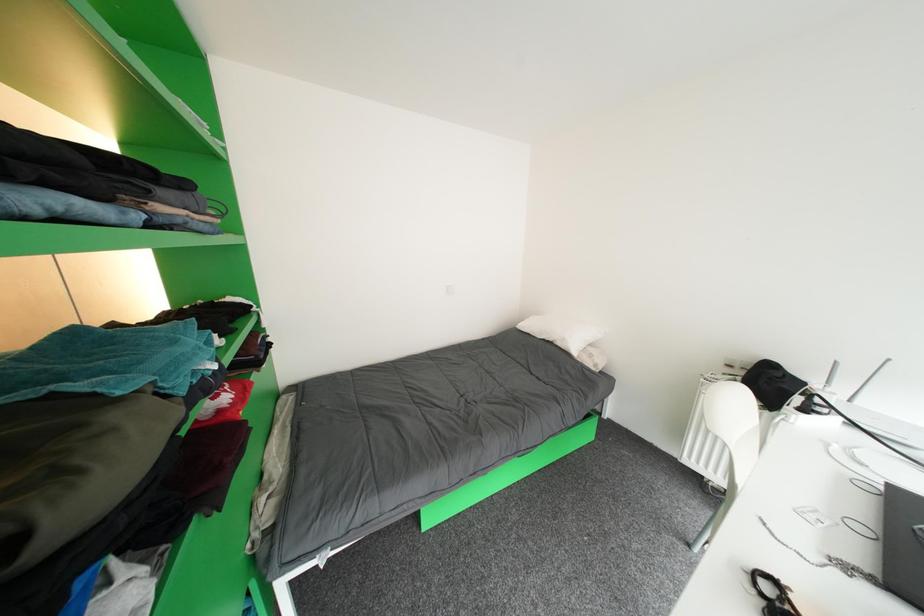
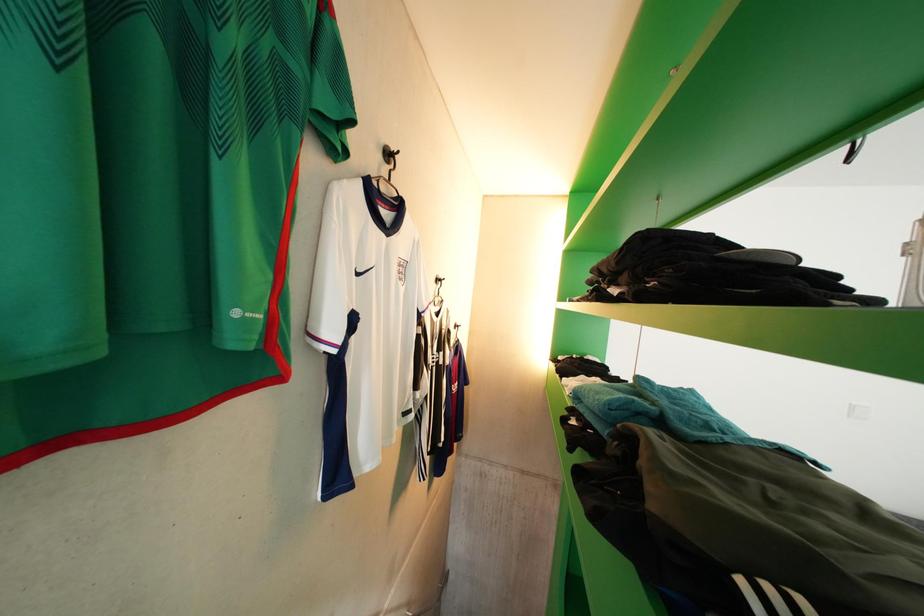
Question: The first image is from the beginning of the video and the second image is from the end. How did the camera likely rotate when shooting the video?

Choices:
 (A) Left
 (B) Right
 (C) Up
 (D) Down

Answer: (A)